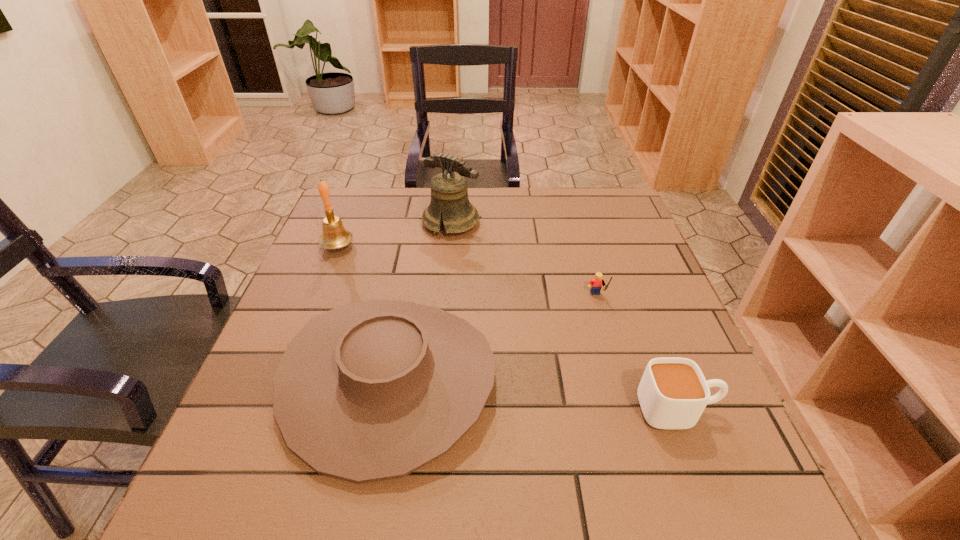
Locate an element on the screen. This screenshot has height=540, width=960. object present at the near edge is located at coordinates (373, 390).

Identify the location of bell that is at the left edge. (334, 236).

This screenshot has width=960, height=540. Identify the location of cowboy hat that is positioned at the left edge. (373, 390).

The height and width of the screenshot is (540, 960). I want to click on cup situated at the right edge, so click(673, 392).

This screenshot has height=540, width=960. I want to click on Lego at the right edge, so click(595, 284).

The image size is (960, 540). In order to click on object present at the near left corner in this screenshot , I will do `click(373, 390)`.

Find the location of `vacant position at the far edge of the desktop`. vacant position at the far edge of the desktop is located at coordinates (519, 207).

In the image, there is a desktop. What are the coordinates of `free space at the near edge` in the screenshot? It's located at (574, 515).

This screenshot has height=540, width=960. Find the location of `free region at the left edge`. free region at the left edge is located at coordinates (260, 413).

In the image, there is a desktop. At what (x,y) coordinates should I click in order to perform the action: click on vacant space at the right edge. Please return your answer as a coordinate pair (x, y). Image resolution: width=960 pixels, height=540 pixels. Looking at the image, I should click on (704, 374).